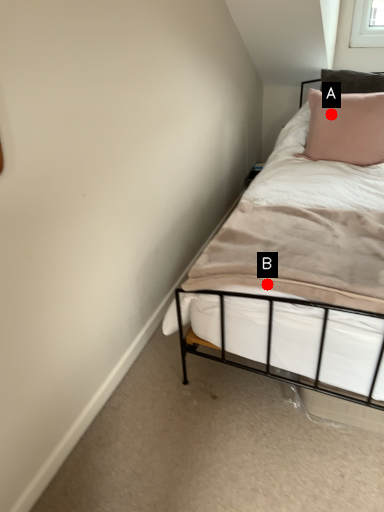
Question: Two points are circled on the image, labeled by A and B beside each circle. Which point is farther from the camera taking this photo?

Choices:
 (A) A is further
 (B) B is further

Answer: (A)